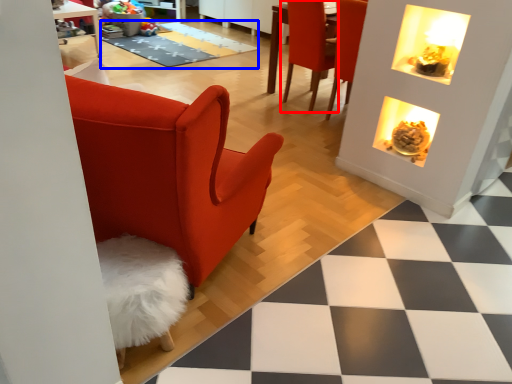
Question: Which of the following is the closest to the observer, chair (highlighted by a red box) or mat (highlighted by a blue box)?

Choices:
 (A) chair
 (B) mat

Answer: (A)